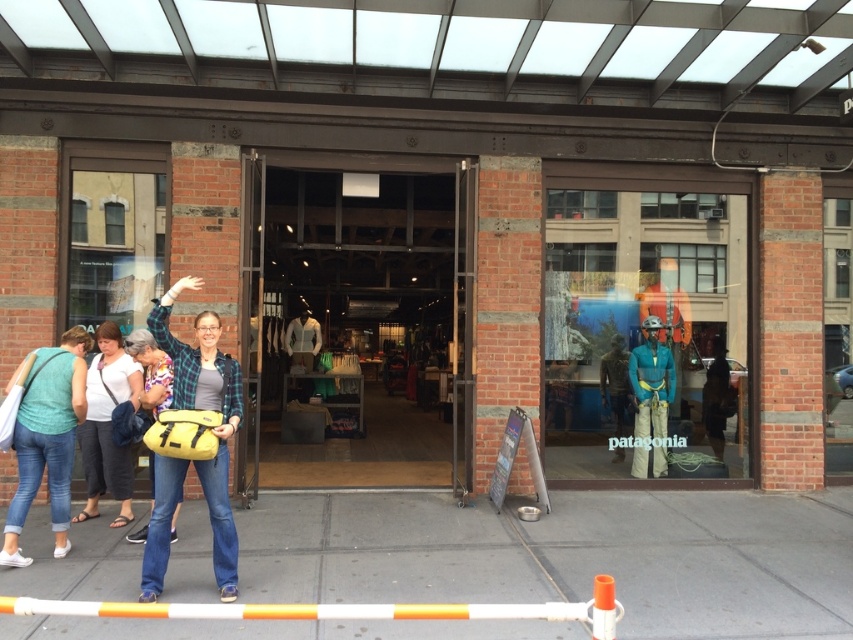
You are standing in front of the Patagonia store and see two points marked on the ground. The first point is at coordinate point(352,502) and the second point is at point(212,557). Which point is closer to you?

Point(352,502) is closer to you because it is further to the viewer than point(212,557).